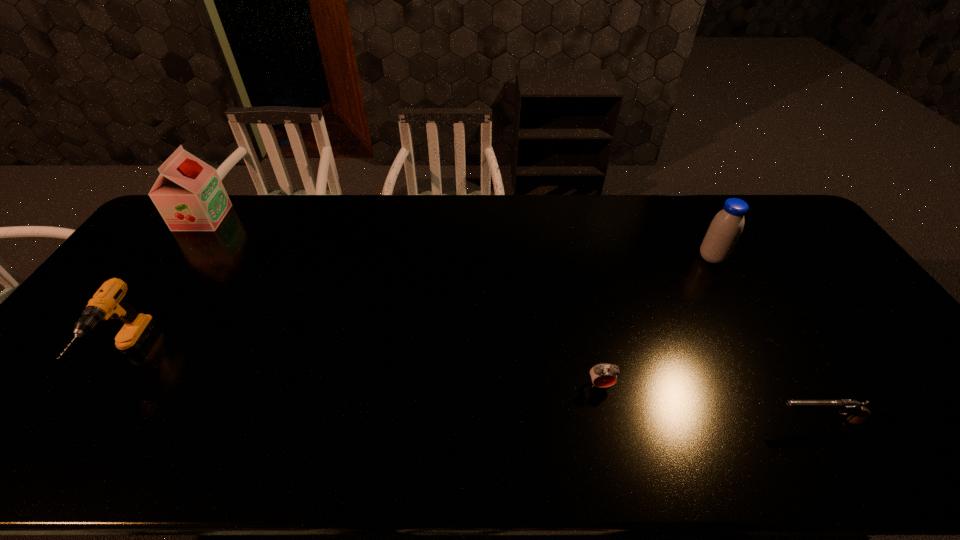
Locate an element on the screen. This screenshot has height=540, width=960. the left soya milk is located at coordinates (189, 195).

Where is `the farthest object`? This screenshot has width=960, height=540. the farthest object is located at coordinates (189, 195).

Locate an element on the screen. The image size is (960, 540). the shorter soya milk is located at coordinates (726, 227).

Where is `the second farthest object`? The image size is (960, 540). the second farthest object is located at coordinates (726, 227).

I want to click on drill, so click(107, 302).

The image size is (960, 540). I want to click on alarm clock, so click(603, 375).

The height and width of the screenshot is (540, 960). Identify the location of the nearest object. (861, 414).

Locate an element on the screen. This screenshot has height=540, width=960. vacant space situated with the cap open on the farther soya milk is located at coordinates (258, 218).

Where is `vacant space situated 0.180m on the right of the right soya milk`? The height and width of the screenshot is (540, 960). vacant space situated 0.180m on the right of the right soya milk is located at coordinates (782, 258).

This screenshot has width=960, height=540. In order to click on vacant region located at the tip of the drill in this screenshot , I will do `click(73, 437)`.